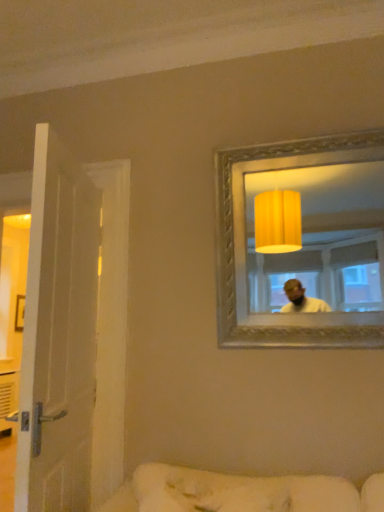
Question: Considering the positions of gold textured mirror at upper right and white fabric couch at lower center in the image, is gold textured mirror at upper right bigger or smaller than white fabric couch at lower center?

Choices:
 (A) small
 (B) big

Answer: (B)

Question: In terms of width, does gold textured mirror at upper right look wider or thinner when compared to white fabric couch at lower center?

Choices:
 (A) thin
 (B) wide

Answer: (A)

Question: Based on their relative distances, which object is nearer to the gold textured mirror at upper right?

Choices:
 (A) white fabric couch at lower center
 (B) white wooden door at left

Answer: (A)

Question: Based on their relative distances, which object is nearer to the white wooden door at left?

Choices:
 (A) gold textured mirror at upper right
 (B) white fabric couch at lower center

Answer: (B)